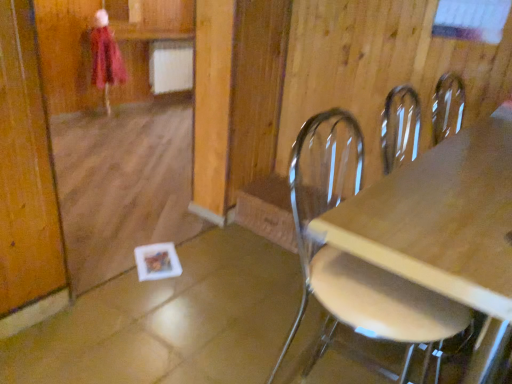
Question: Should I look upward or downward to see metallic silver chair at right?

Choices:
 (A) up
 (B) down

Answer: (B)

Question: From the image's perspective, is metallic silver chair at right below matte pink coat at upper left?

Choices:
 (A) no
 (B) yes

Answer: (B)

Question: Is metallic silver chair at right wider than matte pink coat at upper left?

Choices:
 (A) yes
 (B) no

Answer: (A)

Question: Does metallic silver chair at right have a lesser width compared to matte pink coat at upper left?

Choices:
 (A) no
 (B) yes

Answer: (A)

Question: Is the depth of metallic silver chair at right greater than that of matte pink coat at upper left?

Choices:
 (A) yes
 (B) no

Answer: (B)

Question: Considering the relative sizes of metallic silver chair at right and matte pink coat at upper left in the image provided, is metallic silver chair at right bigger than matte pink coat at upper left?

Choices:
 (A) no
 (B) yes

Answer: (B)

Question: Considering the relative positions of metallic silver chair at right and matte pink coat at upper left in the image provided, is metallic silver chair at right to the left of matte pink coat at upper left from the viewer's perspective?

Choices:
 (A) no
 (B) yes

Answer: (A)

Question: Considering the relative sizes of matte pink coat at upper left and metallic silver chair at right in the image provided, is matte pink coat at upper left thinner than metallic silver chair at right?

Choices:
 (A) yes
 (B) no

Answer: (A)

Question: Is matte pink coat at upper left in front of metallic silver chair at right?

Choices:
 (A) no
 (B) yes

Answer: (A)

Question: Considering the relative positions of matte pink coat at upper left and metallic silver chair at right in the image provided, is matte pink coat at upper left behind metallic silver chair at right?

Choices:
 (A) yes
 (B) no

Answer: (A)

Question: Is matte pink coat at upper left positioned beyond the bounds of metallic silver chair at right?

Choices:
 (A) yes
 (B) no

Answer: (A)

Question: Is matte pink coat at upper left facing towards metallic silver chair at right?

Choices:
 (A) yes
 (B) no

Answer: (A)

Question: Considering the relative sizes of matte pink coat at upper left and metallic silver chair at right in the image provided, is matte pink coat at upper left taller than metallic silver chair at right?

Choices:
 (A) yes
 (B) no

Answer: (B)

Question: Which is correct: metallic silver chair at right is inside matte pink coat at upper left, or outside of it?

Choices:
 (A) outside
 (B) inside

Answer: (A)